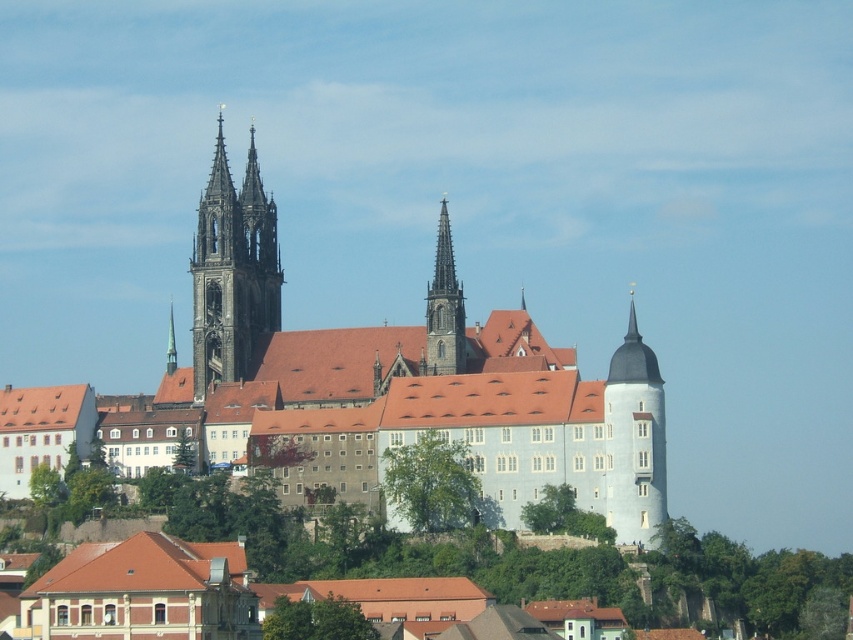
Which of these two, smooth stone church at center or smooth gray stone spire at center, stands taller?

smooth stone church at center is taller.

Consider the image. Does smooth stone church at center have a larger size compared to smooth gray stone spire at center?

Correct, smooth stone church at center is larger in size than smooth gray stone spire at center.

Who is more forward, (657, 512) or (445, 282)?

Point (657, 512) is in front.

I want to click on smooth stone church at center, so click(x=357, y=394).

Between dark gray stone tower at upper left and smooth gray stone spire at center, which one is positioned higher?

Positioned higher is dark gray stone tower at upper left.

Does point (212, 276) come farther from viewer compared to point (438, 362)?

Yes, point (212, 276) is behind point (438, 362).

Find the location of a particular element. dark gray stone tower at upper left is located at coordinates (233, 273).

Can you confirm if smooth stone church at center is shorter than dark gray stone tower at upper left?

No, smooth stone church at center is not shorter than dark gray stone tower at upper left.

Does smooth stone church at center have a greater width compared to dark gray stone tower at upper left?

Yes, smooth stone church at center is wider than dark gray stone tower at upper left.

I want to click on smooth stone church at center, so click(357, 394).